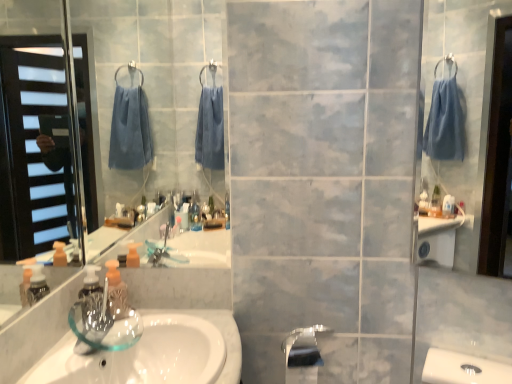
Where is `satin nickel faucet at lower center`? Image resolution: width=512 pixels, height=384 pixels. satin nickel faucet at lower center is located at coordinates (303, 354).

Locate an element on the screen. satin nickel faucet at lower center is located at coordinates (303, 338).

Which object is closer to the camera, satin nickel faucet at lower center or satin nickel faucet at lower center?

satin nickel faucet at lower center.

Which is in front, point (311, 363) or point (288, 341)?

Positioned in front is point (311, 363).

Considering the relative sizes of satin nickel faucet at lower center and satin nickel faucet at lower center in the image provided, is satin nickel faucet at lower center smaller than satin nickel faucet at lower center?

No.

From a real-world perspective, which object stands above the other?

In real-world perspective, satin nickel faucet at lower center is above.

Is transparent glass soap dispenser at lower left positioned far away from white glossy sink at lower left?

Actually, transparent glass soap dispenser at lower left and white glossy sink at lower left are a little close together.

Is white glossy sink at lower left surrounded by transparent glass soap dispenser at lower left?

No.

Does point (118, 281) appear closer or farther from the camera than point (225, 343)?

Clearly, point (118, 281) is more distant from the camera than point (225, 343).

Consider the image. Is satin nickel faucet at lower center closer to camera compared to satin nickel faucet at lower center?

Yes, it is in front of satin nickel faucet at lower center.

From the picture: Can you tell me how much satin nickel faucet at lower center and satin nickel faucet at lower center differ in facing direction?

0.00278 degrees separate the facing orientations of satin nickel faucet at lower center and satin nickel faucet at lower center.

From the picture: Is satin nickel faucet at lower center bigger or smaller than satin nickel faucet at lower center?

In the image, satin nickel faucet at lower center appears to be smaller than satin nickel faucet at lower center.

Based on the photo, is satin nickel faucet at lower center shorter than satin nickel faucet at lower center?

Correct, satin nickel faucet at lower center is not as tall as satin nickel faucet at lower center.

Which of these two, white glossy sink at lower left or satin nickel faucet at lower center, is thinner?

With smaller width is satin nickel faucet at lower center.

Is white glossy sink at lower left shorter than satin nickel faucet at lower center?

Yes, white glossy sink at lower left is shorter than satin nickel faucet at lower center.

Would you say white glossy sink at lower left is outside satin nickel faucet at lower center?

Yes, white glossy sink at lower left is located beyond the bounds of satin nickel faucet at lower center.

Where is `tap below the white glossy sink at lower left (from the image's perspective)`? Image resolution: width=512 pixels, height=384 pixels. tap below the white glossy sink at lower left (from the image's perspective) is located at coordinates (303, 354).

Is transparent glass soap dispenser at lower left closer to the viewer compared to satin nickel faucet at lower center?

Yes.

In terms of size, does transparent glass soap dispenser at lower left appear bigger or smaller than satin nickel faucet at lower center?

transparent glass soap dispenser at lower left is smaller than satin nickel faucet at lower center.

Which object is thinner, transparent glass soap dispenser at lower left or satin nickel faucet at lower center?

With smaller width is transparent glass soap dispenser at lower left.

Is transparent glass soap dispenser at lower left situated inside satin nickel faucet at lower center or outside?

The correct answer is: outside.

Is satin nickel faucet at lower center far from transparent glass soap dispenser at lower left?

satin nickel faucet at lower center is near transparent glass soap dispenser at lower left, not far away.

Is transparent glass soap dispenser at lower left located within satin nickel faucet at lower center?

That's incorrect, transparent glass soap dispenser at lower left is not inside satin nickel faucet at lower center.

Consider the image. Could you tell me if satin nickel faucet at lower center is facing transparent glass soap dispenser at lower left?

No, satin nickel faucet at lower center is not aimed at transparent glass soap dispenser at lower left.

How many degrees apart are the facing directions of satin nickel faucet at lower center and transparent glass soap dispenser at lower left?

89.9 degrees.

Which object is more forward, satin nickel faucet at lower center or transparent glass soap dispenser at lower left?

transparent glass soap dispenser at lower left is closer to the camera.

Based on their positions, is satin nickel faucet at lower center located to the left or right of transparent glass soap dispenser at lower left?

In the image, satin nickel faucet at lower center appears on the right side of transparent glass soap dispenser at lower left.

Based on the photo, which is closer, (306, 329) or (122, 307)?

Clearly, point (306, 329) is more distant from the camera than point (122, 307).

Is satin nickel faucet at lower center next to transparent glass soap dispenser at lower left?

satin nickel faucet at lower center and transparent glass soap dispenser at lower left are clearly separated.

Image resolution: width=512 pixels, height=384 pixels. Identify the location of faucet above the satin nickel faucet at lower center (from a real-world perspective). (303, 338).

Locate an element on the screen. The width and height of the screenshot is (512, 384). soap dispenser lying on the left of white glossy sink at lower left is located at coordinates (116, 291).

Estimate the real-world distances between objects in this image. Which object is further from white glossy sink at lower left, transparent glass soap dispenser at lower left or satin nickel faucet at lower center?

satin nickel faucet at lower center.

Considering their positions, is transparent glass soap dispenser at lower left positioned further to satin nickel faucet at lower center than white glossy sink at lower left?

transparent glass soap dispenser at lower left lies further to satin nickel faucet at lower center than the other object.

Estimate the real-world distances between objects in this image. Which object is further from white glossy sink at lower left, satin nickel faucet at lower center or satin nickel faucet at lower center?

satin nickel faucet at lower center lies further to white glossy sink at lower left than the other object.

Looking at the image, which one is located further to satin nickel faucet at lower center, satin nickel faucet at lower center or white glossy sink at lower left?

white glossy sink at lower left is positioned further to the anchor satin nickel faucet at lower center.

From the image, which object appears to be nearer to satin nickel faucet at lower center, satin nickel faucet at lower center or transparent glass soap dispenser at lower left?

The object closer to satin nickel faucet at lower center is satin nickel faucet at lower center.

Which object lies further to the anchor point transparent glass soap dispenser at lower left, white glossy sink at lower left or satin nickel faucet at lower center?

Among the two, satin nickel faucet at lower center is located further to transparent glass soap dispenser at lower left.

Based on their spatial positions, is satin nickel faucet at lower center or white glossy sink at lower left further from satin nickel faucet at lower center?

white glossy sink at lower left.

Estimate the real-world distances between objects in this image. Which object is closer to satin nickel faucet at lower center, white glossy sink at lower left or satin nickel faucet at lower center?

satin nickel faucet at lower center.

Identify the location of sink between transparent glass soap dispenser at lower left and satin nickel faucet at lower center from left to right. (154, 353).

In order to click on tap between transparent glass soap dispenser at lower left and satin nickel faucet at lower center from left to right in this screenshot , I will do `click(303, 354)`.

At what (x,y) coordinates should I click in order to perform the action: click on tap between white glossy sink at lower left and satin nickel faucet at lower center in the horizontal direction. Please return your answer as a coordinate pair (x, y). Looking at the image, I should click on [x=303, y=354].

Locate an element on the screen. This screenshot has height=384, width=512. sink situated between transparent glass soap dispenser at lower left and satin nickel faucet at lower center from left to right is located at coordinates (154, 353).